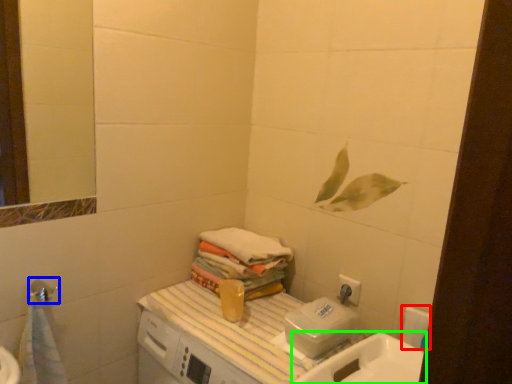
Question: Estimate the real-world distances between objects in this image. Which object is farther from toilet paper (highlighted by a red box), shower (highlighted by a blue box) or sink (highlighted by a green box)?

Choices:
 (A) shower
 (B) sink

Answer: (A)